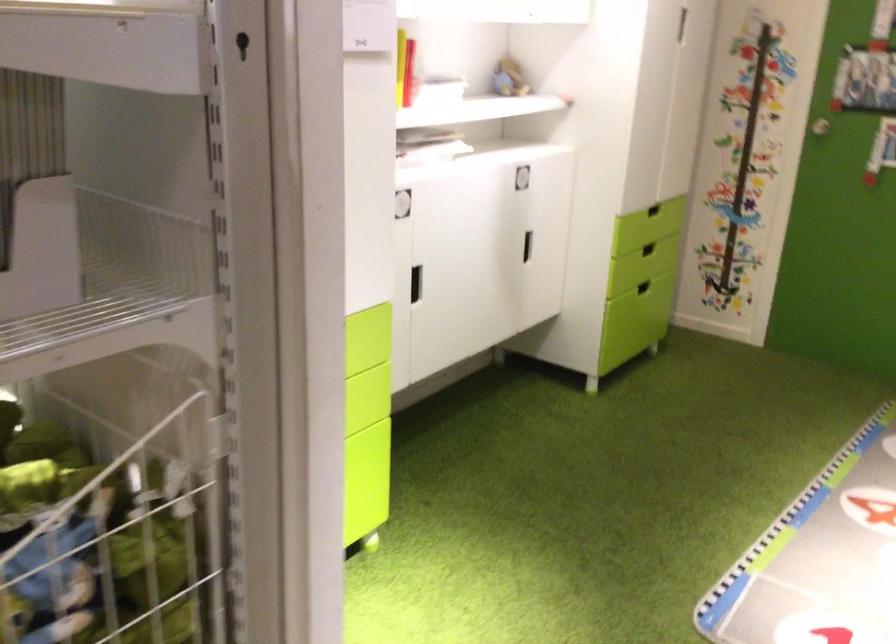
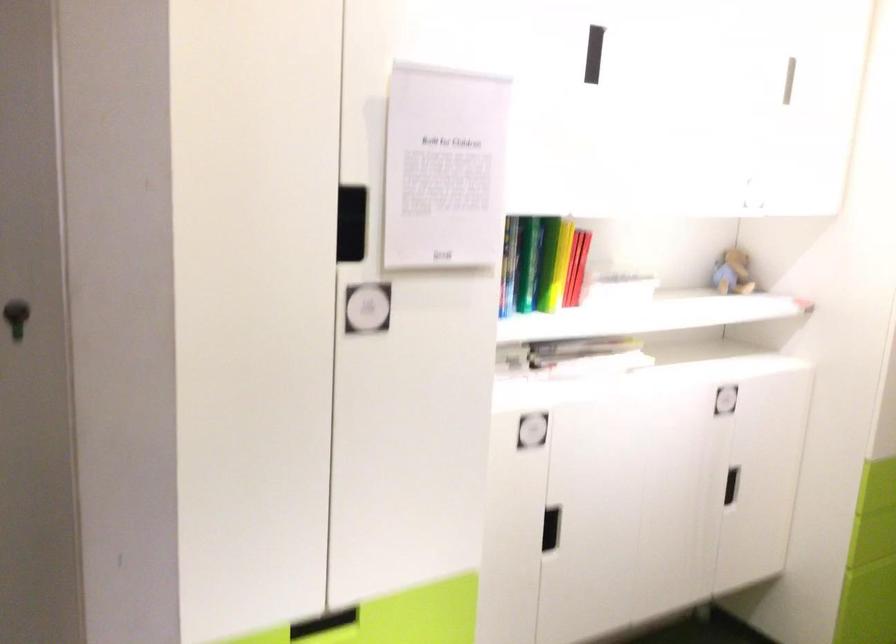
Locate, in the second image, the point that corresponds to [511,77] in the first image.

(733, 272)